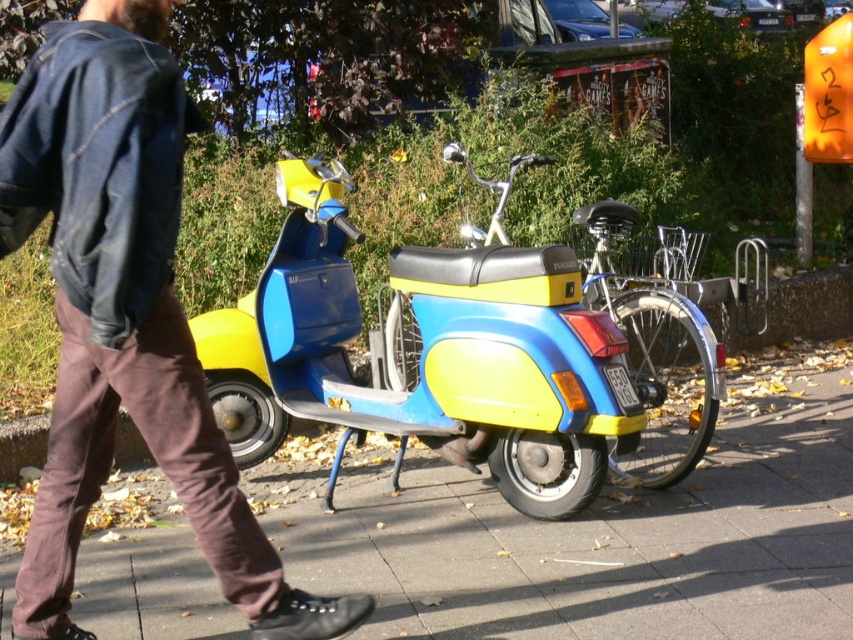
Question: Where is smooth concrete pavement at center located in relation to yellow matte scooter at center in the image?

Choices:
 (A) below
 (B) above

Answer: (A)

Question: Which of the following is the farthest from the observer?

Choices:
 (A) smooth concrete pavement at center
 (B) denim jacket at left
 (C) yellow matte scooter at center

Answer: (C)

Question: Based on their relative distances, which object is farther from the smooth concrete pavement at center?

Choices:
 (A) yellow matte scooter at center
 (B) denim jacket at left

Answer: (B)

Question: Is the position of denim jacket at left less distant than that of yellow matte scooter at center?

Choices:
 (A) no
 (B) yes

Answer: (B)

Question: Is smooth concrete pavement at center to the right of yellow matte scooter at center from the viewer's perspective?

Choices:
 (A) no
 (B) yes

Answer: (B)

Question: Among these objects, which one is farthest from the camera?

Choices:
 (A) smooth concrete pavement at center
 (B) yellow matte scooter at center

Answer: (B)